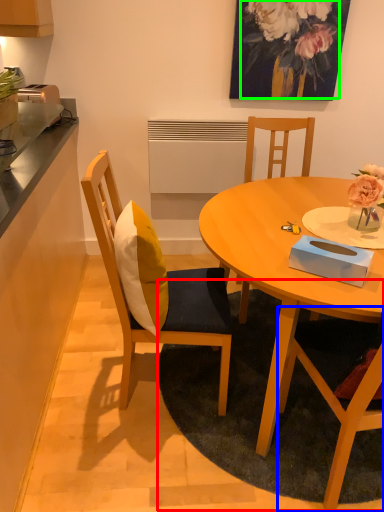
Question: Which object is the closest to the mat (highlighted by a red box)? Choose among these: chair (highlighted by a blue box) or floral arrangement (highlighted by a green box).

Choices:
 (A) chair
 (B) floral arrangement

Answer: (A)